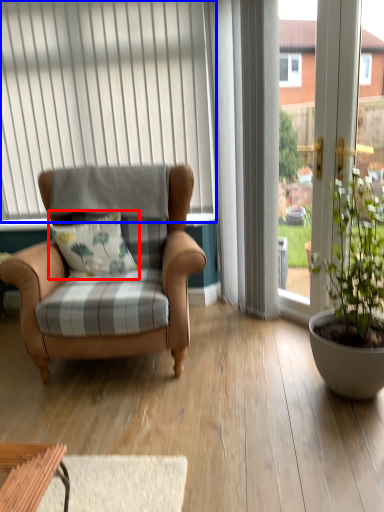
Question: Which of the following is the farthest to the observer, pillow (highlighted by a red box) or curtain (highlighted by a blue box)?

Choices:
 (A) pillow
 (B) curtain

Answer: (B)